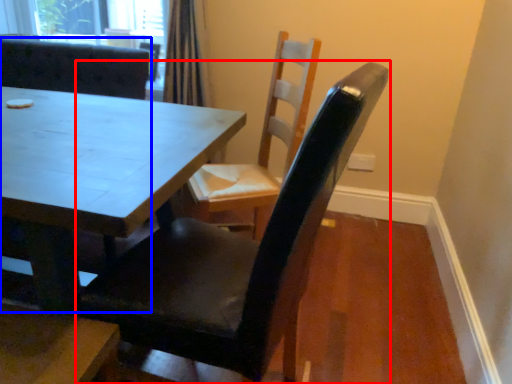
Question: Which object is further to the camera taking this photo, chair (highlighted by a red box) or chair (highlighted by a blue box)?

Choices:
 (A) chair
 (B) chair

Answer: (B)